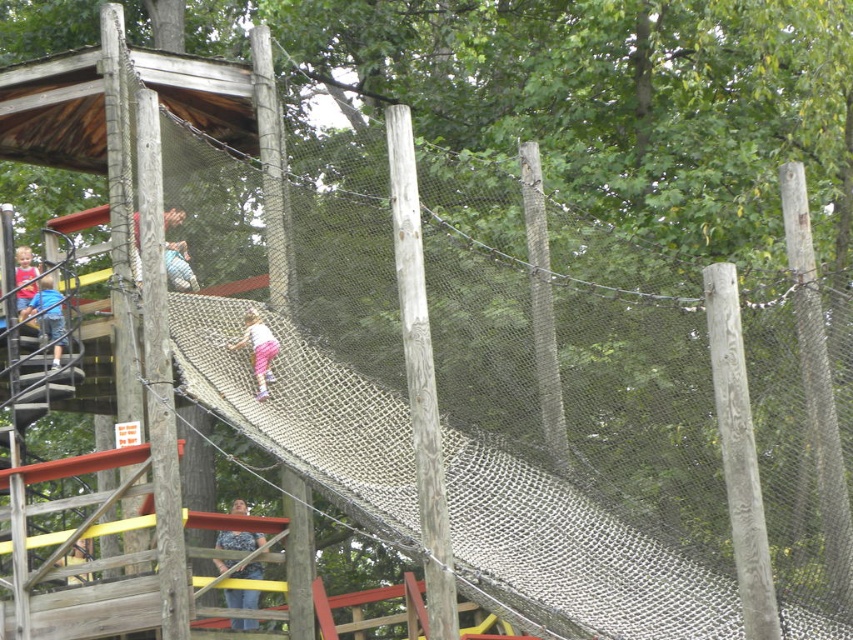
You are standing at the base of the playground structure and see the blue denim jeans at lower center. According to the coordinates provided, is the blue denim jeans closer to the top or the bottom of the image?

The blue denim jeans at lower center is located at point 0.845 in the x coordinate and 0.281 in the y coordinate. Since the y coordinate is closer to 0, which typically represents the bottom of the image, the blue denim jeans at lower center is closer to the bottom of the image.

You are standing at the base of the playground structure and want to locate the blue fabric at left. According to the coordinates provided, where would you look relative to the structure?

The blue fabric at left is located at the top left corner of the playground structure, as its 2D coordinates are at point (48, 316).

Looking at this image, you are a child at the playground and you see the blue fabric at left and the pink fabric pants at center. Which one is closer to your left side?

The blue fabric at left is closer to your left side because it is positioned to the left of the pink fabric pants at center.